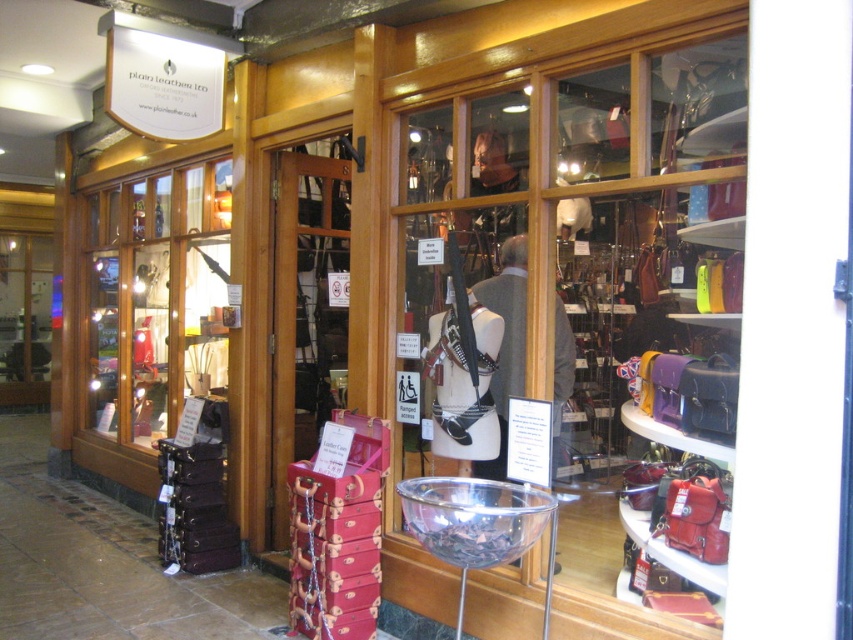
You are a customer entering the store and see the shiny metallic bowl at center and the matte black suitcase at left. Which item is closer to the entrance?

The matte black suitcase at left is closer to the entrance because it is positioned to the left of the shiny metallic bowl at center, which is further to the right.

You are a customer in the store and want to place a small keychain on one of the two items, the shiny metallic bowl at center or the matte black suitcase at left. Based on their sizes, which item would be more suitable for placing the keychain?

The shiny metallic bowl at center occupies less space than the matte black suitcase at left, so the matte black suitcase at left has more space and would be more suitable for placing the keychain.